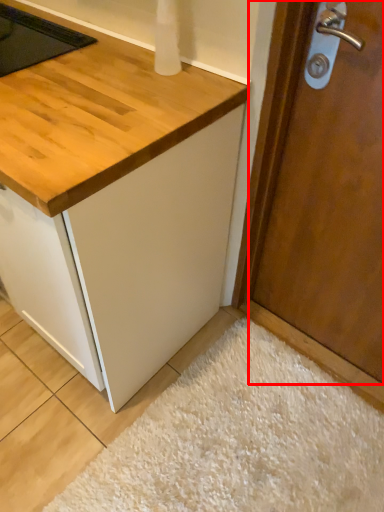
Question: From the image, what is the correct spatial relationship of door (annotated by the red box) in relation to plain?

Choices:
 (A) left
 (B) right

Answer: (B)